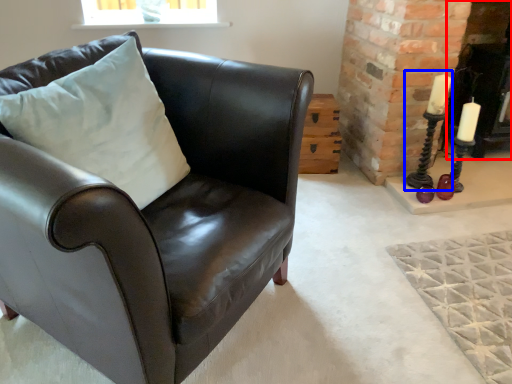
Question: Which object is further to the camera taking this photo, fireplace (highlighted by a red box) or candle holder (highlighted by a blue box)?

Choices:
 (A) fireplace
 (B) candle holder

Answer: (A)